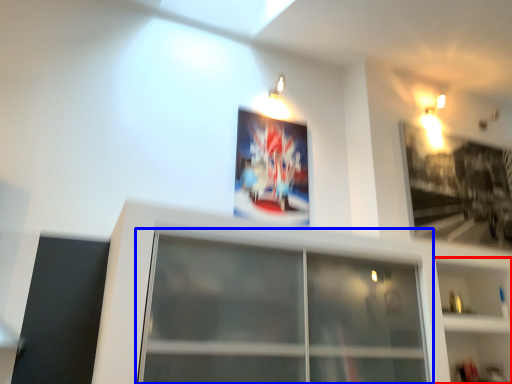
Question: Which object appears closest to the camera in this image, shelf (highlighted by a red box) or window (highlighted by a blue box)?

Choices:
 (A) shelf
 (B) window

Answer: (B)